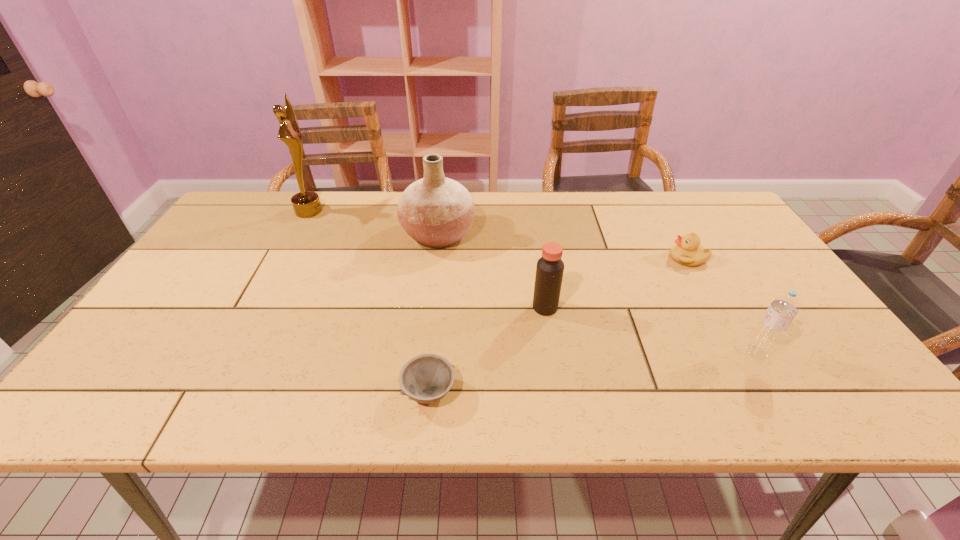
The image size is (960, 540). I want to click on object that is positioned at the right edge, so click(x=773, y=325).

In the image, there is a desktop. At what (x,y) coordinates should I click in order to perform the action: click on vacant space at the far edge. Please return your answer as a coordinate pair (x, y). This screenshot has height=540, width=960. Looking at the image, I should click on (519, 200).

Locate an element on the screen. This screenshot has width=960, height=540. free space at the near edge is located at coordinates (283, 383).

Where is `free location at the left edge`? free location at the left edge is located at coordinates (175, 328).

Find the location of a particular element. vacant space at the right edge is located at coordinates (791, 358).

Locate an element on the screen. vacant area at the far left corner of the desktop is located at coordinates (238, 229).

Where is `free region at the far right corner`? free region at the far right corner is located at coordinates (684, 210).

Locate an element on the screen. This screenshot has height=540, width=960. free space at the near right corner is located at coordinates (852, 411).

Locate an element on the screen. The image size is (960, 540). unoccupied area between the water bottle and the second shortest object is located at coordinates (722, 306).

Locate an element on the screen. This screenshot has width=960, height=540. free spot between the bowl and the second shortest object is located at coordinates (559, 325).